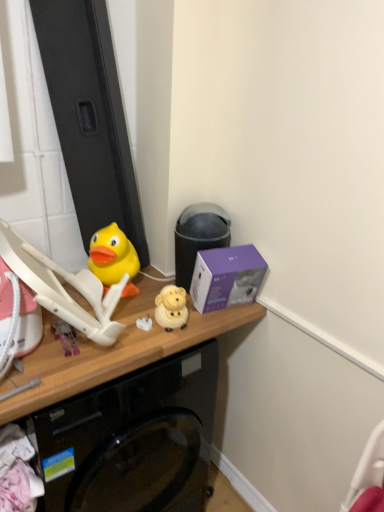
Question: Is white matte plug at center, which appears as the third toy when viewed from the left, positioned with its back to purple matte box at upper right?

Choices:
 (A) no
 (B) yes

Answer: (A)

Question: Is white matte plug at center, which appears as the third toy when viewed from the left, beside purple matte box at upper right?

Choices:
 (A) no
 (B) yes

Answer: (A)

Question: Are white matte plug at center, which appears as the third toy when viewed from the left, and purple matte box at upper right located far from each other?

Choices:
 (A) yes
 (B) no

Answer: (B)

Question: Can you confirm if white matte plug at center, which appears as the third toy when viewed from the left, is thinner than purple matte box at upper right?

Choices:
 (A) yes
 (B) no

Answer: (A)

Question: From the image's perspective, is white matte plug at center, which appears as the third toy when viewed from the left, below purple matte box at upper right?

Choices:
 (A) yes
 (B) no

Answer: (A)

Question: From the image's perspective, relative to purple matte box at upper right, is wooden desk at center above or below?

Choices:
 (A) above
 (B) below

Answer: (B)

Question: Is wooden desk at center to the left or to the right of purple matte box at upper right in the image?

Choices:
 (A) right
 (B) left

Answer: (B)

Question: Would you say wooden desk at center is inside or outside purple matte box at upper right?

Choices:
 (A) outside
 (B) inside

Answer: (A)

Question: Is wooden desk at center wider or thinner than purple matte box at upper right?

Choices:
 (A) thin
 (B) wide

Answer: (B)

Question: Visually, is white matte plug at center, which is the 2th toy from right to left, positioned to the left or to the right of purple matte box at upper right?

Choices:
 (A) left
 (B) right

Answer: (A)

Question: Based on their sizes in the image, would you say white matte plug at center, which appears as the third toy when viewed from the left, is bigger or smaller than purple matte box at upper right?

Choices:
 (A) small
 (B) big

Answer: (A)

Question: From a real-world perspective, relative to purple matte box at upper right, is white matte plug at center, which is the 2th toy from right to left, vertically above or below?

Choices:
 (A) below
 (B) above

Answer: (A)

Question: Considering the positions of point (142, 323) and point (246, 296), is point (142, 323) closer or farther from the camera than point (246, 296)?

Choices:
 (A) closer
 (B) farther

Answer: (A)

Question: Is wooden desk at center bigger or smaller than yellow matte sheep at center, marked as the fourth toy in a left-to-right arrangement?

Choices:
 (A) big
 (B) small

Answer: (A)

Question: Considering the positions of point (59, 350) and point (170, 322), is point (59, 350) closer or farther from the camera than point (170, 322)?

Choices:
 (A) farther
 (B) closer

Answer: (B)